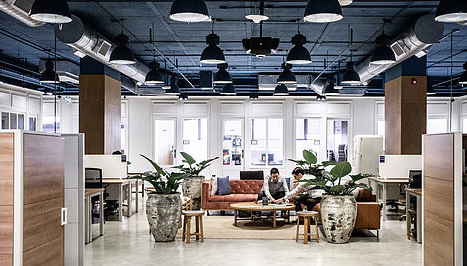
The height and width of the screenshot is (266, 467). I want to click on 2 couches, so click(x=365, y=209), click(x=246, y=186).